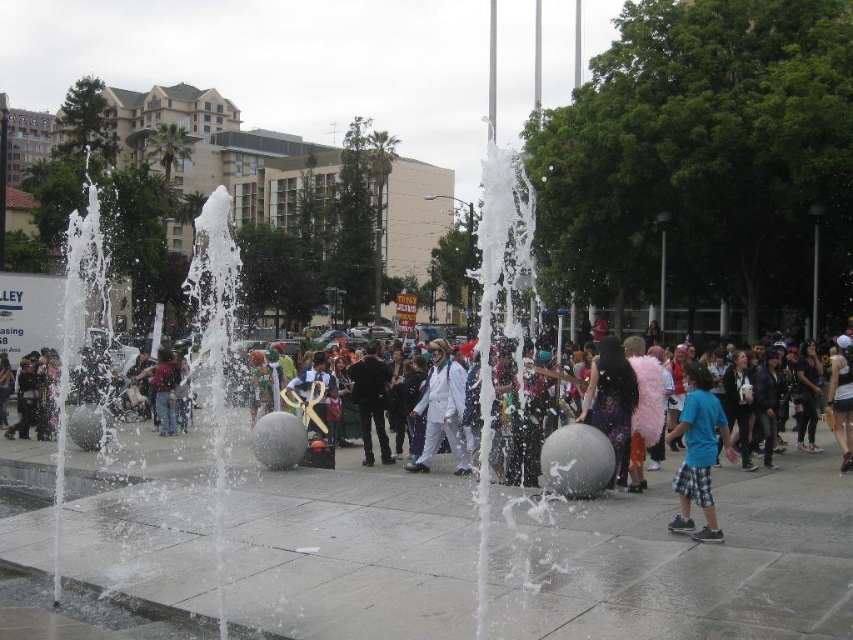
Between white fluffy coat at center and blue plaid shorts at lower right, which one appears on the left side from the viewer's perspective?

white fluffy coat at center is more to the left.

Can you confirm if white fluffy coat at center is shorter than blue plaid shorts at lower right?

Incorrect, white fluffy coat at center's height does not fall short of blue plaid shorts at lower right's.

Measure the distance between white fluffy coat at center and camera.

white fluffy coat at center is 16.19 meters from camera.

The image size is (853, 640). Identify the location of white fluffy coat at center. (146, 452).

Is white glossy water at center shorter than white matte suit at center?

Incorrect, white glossy water at center's height does not fall short of white matte suit at center's.

You are a GUI agent. You are given a task and a screenshot of the screen. Output one action in this format:
    pyautogui.click(x=<x>, y=<y>)
    Task: Click on the white glossy water at center
    This screenshot has height=640, width=853.
    Given the screenshot: What is the action you would take?
    pyautogui.click(x=215, y=358)

What are the coordinates of `white glossy water at center` in the screenshot? It's located at (215, 358).

Between white fluffy coat at center and white matte suit at center, which one has less height?

white fluffy coat at center

Does white fluffy coat at center appear under white matte suit at center?

Indeed, white fluffy coat at center is positioned under white matte suit at center.

The height and width of the screenshot is (640, 853). In order to click on white fluffy coat at center in this screenshot , I will do `click(146, 452)`.